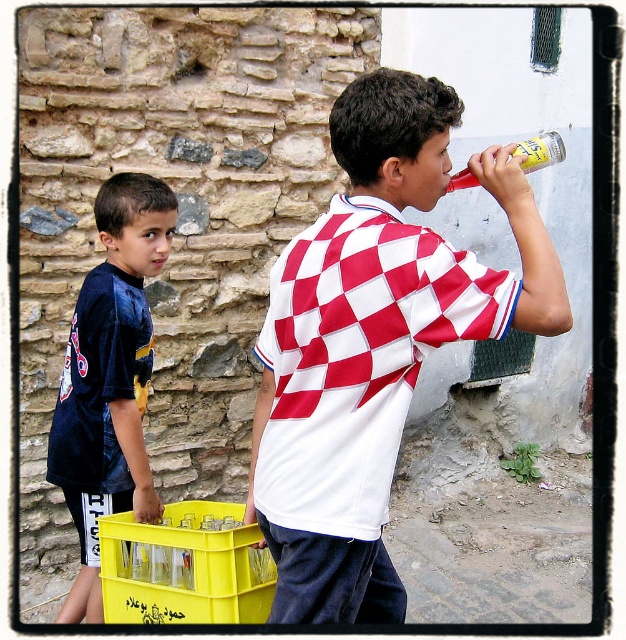
You are a photographer trying to capture a candid shot of the two boys. You notice the white checkered shirt at center and the translucent plastic bottle at upper right. Which object is positioned higher in the image?

The white checkered shirt at center is much taller than the translucent plastic bottle at upper right, so the white checkered shirt at center is positioned higher in the image.

You are a delivery person who needs to place a package between the white checkered shirt at center and the dark blue jersey at left. Can you fit the package if it measures 25 inches in length?

The distance between the white checkered shirt at center and the dark blue jersey at left is 25.26 inches, so yes, the package can fit as it is slightly shorter than the available space.